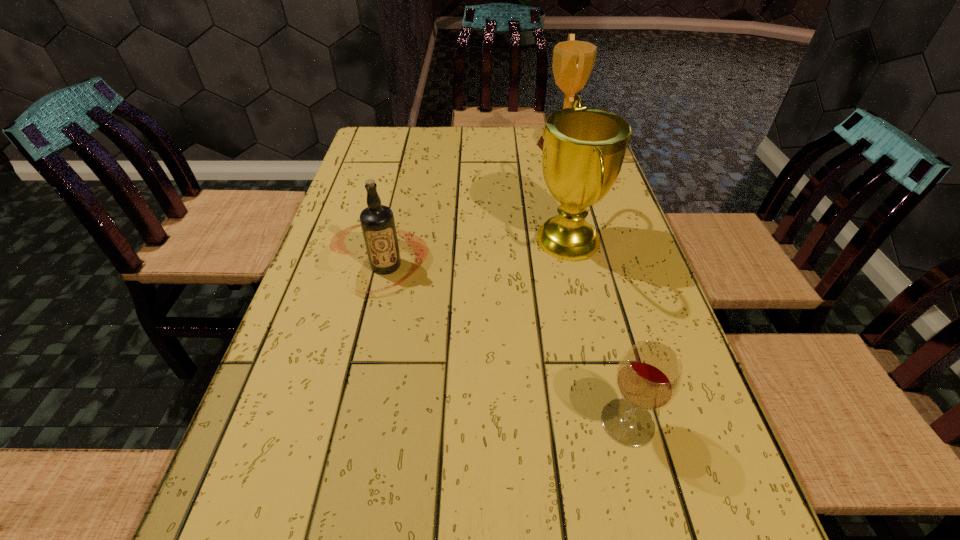
At what (x,y) coordinates should I click in order to perform the action: click on vacant position at the right edge of the desktop. Please return your answer as a coordinate pair (x, y). The height and width of the screenshot is (540, 960). Looking at the image, I should click on (652, 273).

This screenshot has height=540, width=960. Identify the location of vacant region at the far left corner. (367, 153).

The height and width of the screenshot is (540, 960). Find the location of `free space between the farther award and the wineglass`. free space between the farther award and the wineglass is located at coordinates (595, 284).

Identify the location of blank region between the wineglass and the farthest object. This screenshot has height=540, width=960. (595, 284).

At what (x,y) coordinates should I click in order to perform the action: click on free spot between the second shortest object and the nearer award. Please return your answer as a coordinate pair (x, y). The image size is (960, 540). Looking at the image, I should click on [477, 253].

The height and width of the screenshot is (540, 960). What are the coordinates of `free space that is in between the leftmost object and the farthest object` in the screenshot? It's located at (474, 206).

Where is `free space between the farther award and the third tallest object`? The height and width of the screenshot is (540, 960). free space between the farther award and the third tallest object is located at coordinates (474, 206).

Locate an element on the screen. Image resolution: width=960 pixels, height=540 pixels. vacant space that is in between the root beer and the farthest object is located at coordinates (474, 206).

This screenshot has width=960, height=540. What are the coordinates of `the third closest object to the farthest object` in the screenshot? It's located at (649, 375).

Point out which object is positioned as the third nearest to the nearer award. Please provide its 2D coordinates. Your answer should be formatted as a tuple, i.e. [(x, y)], where the tuple contains the x and y coordinates of a point satisfying the conditions above.

[(649, 375)]